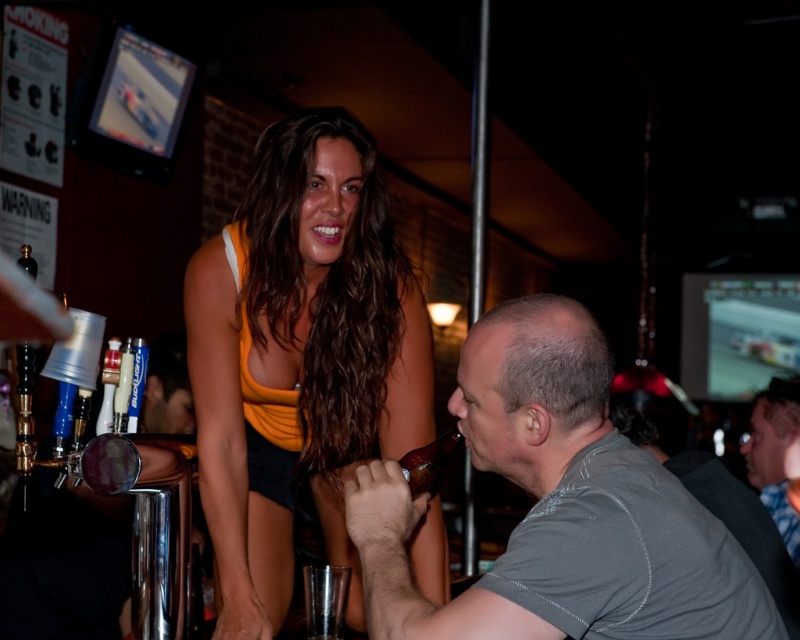
Question: Can you confirm if orange fabric top at center is smaller than yellow fabric bikini top at upper center?

Choices:
 (A) no
 (B) yes

Answer: (A)

Question: Is orange fabric top at center below brown glass bottle at lower center?

Choices:
 (A) yes
 (B) no

Answer: (B)

Question: Which point is farther from the camera taking this photo?

Choices:
 (A) (408, 484)
 (B) (412, 296)

Answer: (B)

Question: Can you confirm if orange fabric top at center is bigger than yellow fabric bikini top at upper center?

Choices:
 (A) yes
 (B) no

Answer: (A)

Question: Which object appears closest to the camera in this image?

Choices:
 (A) brown glass bottle at lower center
 (B) gray fabric shirt at upper right

Answer: (A)

Question: Which point is farther from the camera taking this photo?

Choices:
 (A) (716, 525)
 (B) (417, 488)
 (C) (798, 424)
 (D) (332, 392)

Answer: (C)